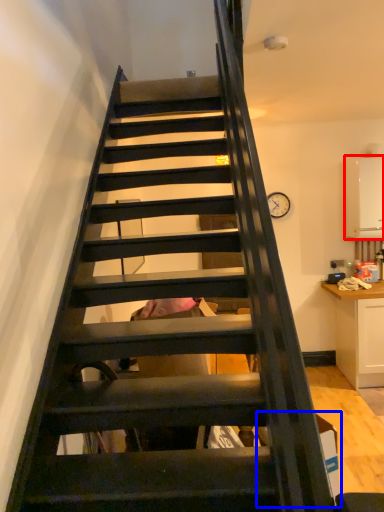
Question: Which object is closer to the camera taking this photo, appliance (highlighted by a red box) or cardboard box (highlighted by a blue box)?

Choices:
 (A) appliance
 (B) cardboard box

Answer: (B)